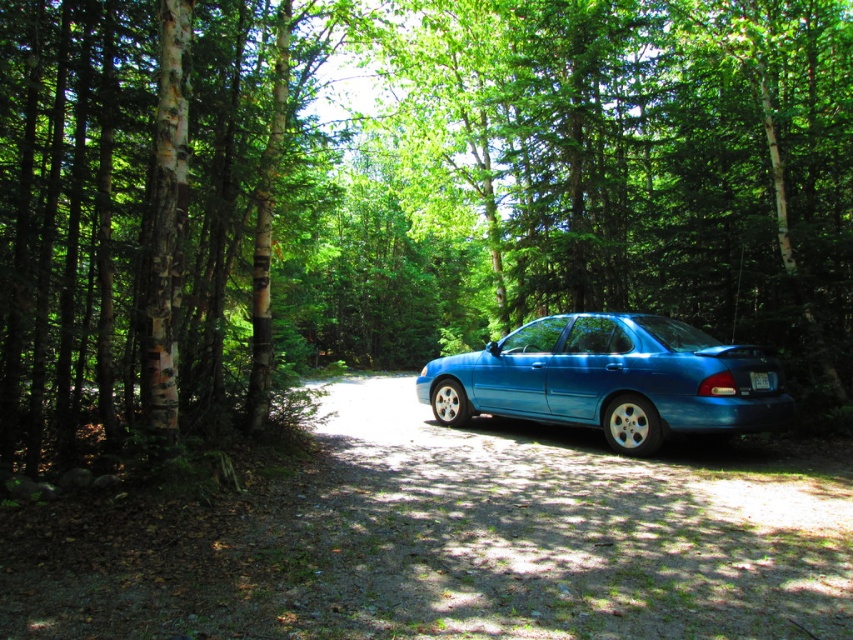
You are a driver who wants to back up the glossy blue sedan at center into a parking spot behind it. However, there is a white plastic license plate at rear blocking the path. Based on the scene, can you safely back up without hitting the license plate?

The glossy blue sedan at center is in front of the white plastic license plate at rear, meaning the license plate is behind the car. Therefore, backing up would move the car towards the license plate, so there is a risk of collision. You should check the surroundings and ensure there is enough space before backing up.

You are a driver who just parked your car in a forest. You want to check if your glossy blue sedan at center is positioned correctly so that the white plastic license plate at rear is visible from the road. Based on the scene, is the license plate visible?

The glossy blue sedan at center is to the left of white plastic license plate at rear, so the license plate is positioned on the rear of the car and should be visible from behind the car when viewed from the road.